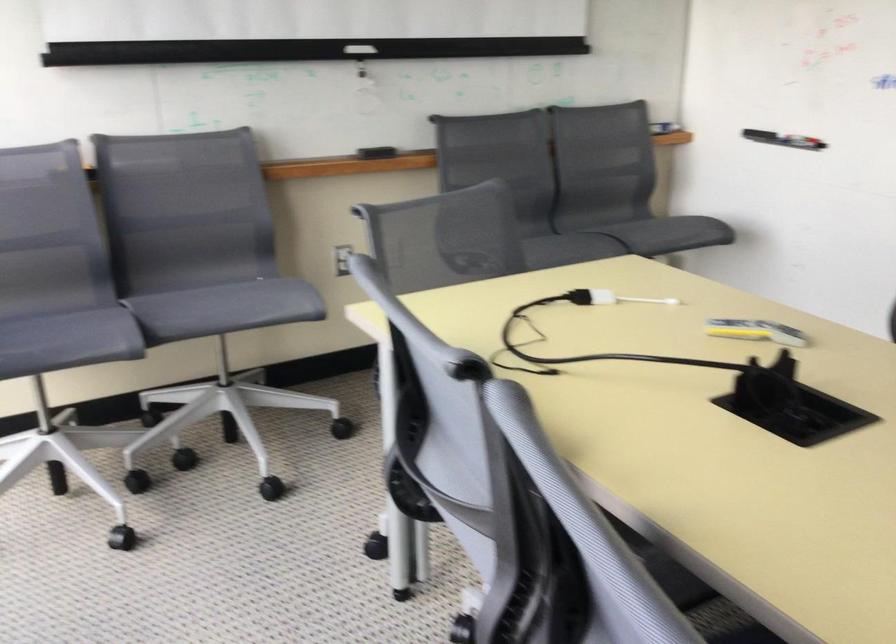
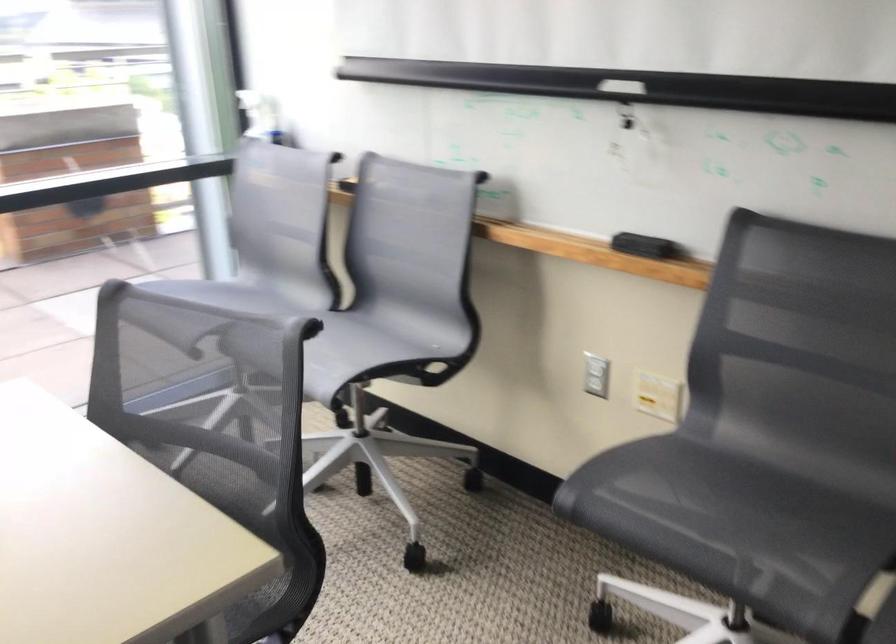
Locate, in the second image, the point that corresponds to (378,147) in the first image.

(643, 245)